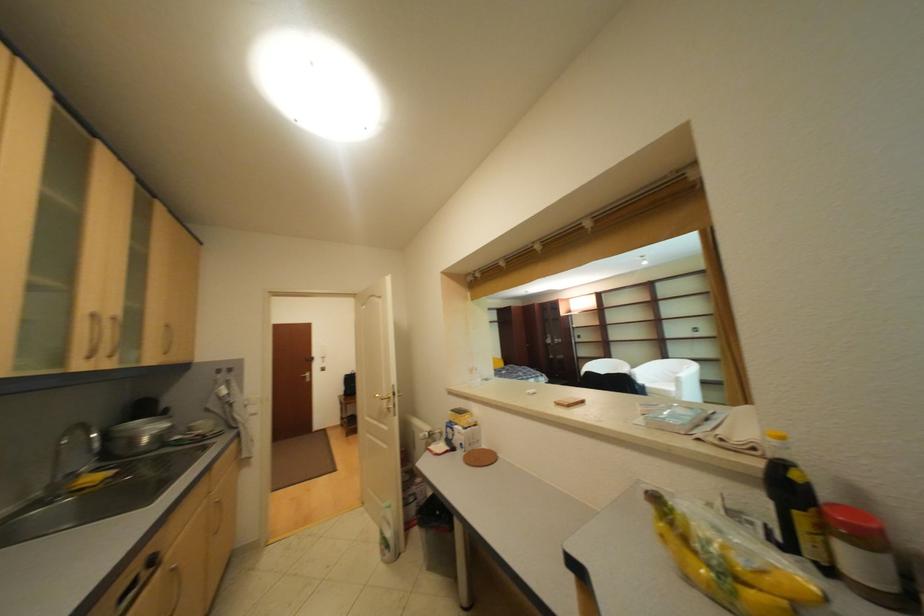
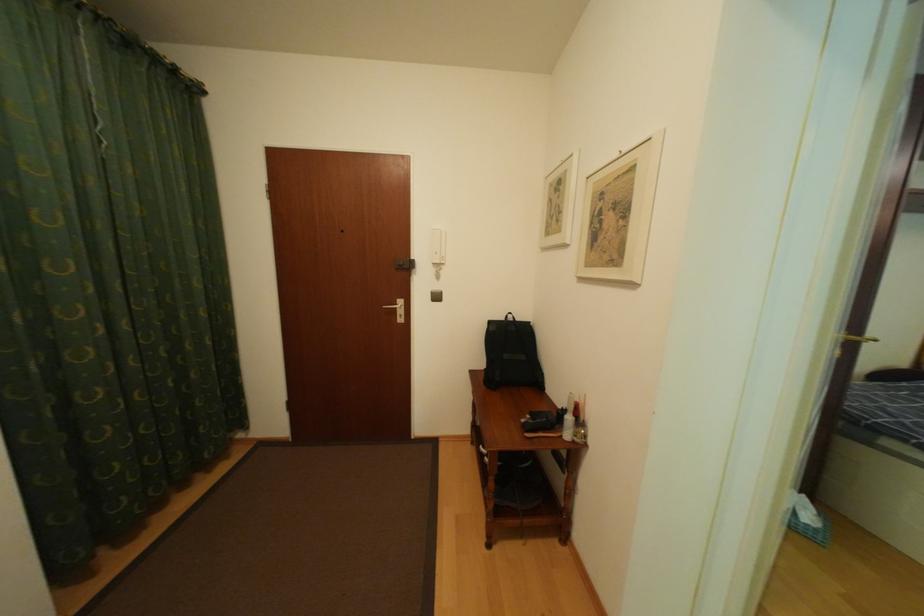
The point at (351, 398) is marked in the first image. Where is the corresponding point in the second image?

(484, 374)